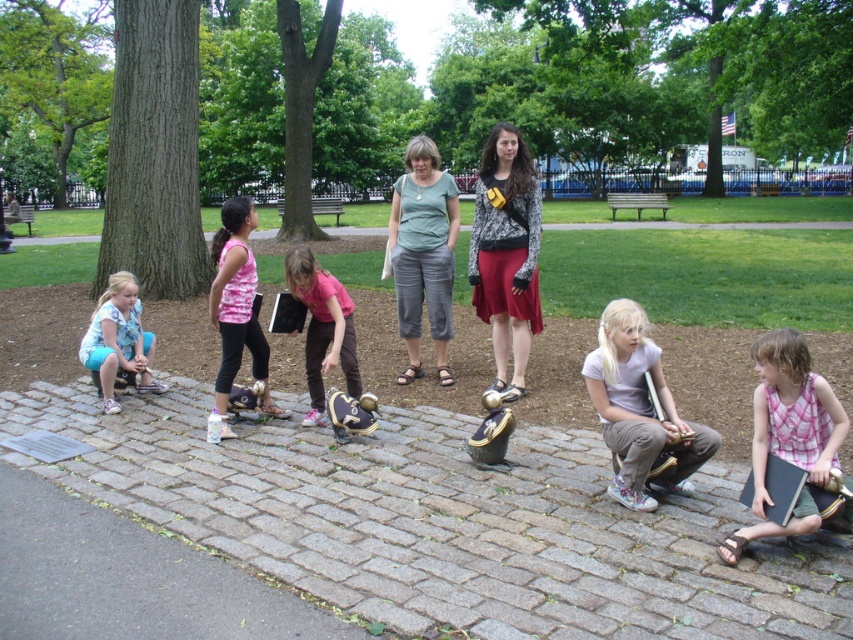
Question: Is pink plaid shirt at lower right above matte pink tank top at center?

Choices:
 (A) no
 (B) yes

Answer: (A)

Question: Is matte green blouse at center to the left of light blue denim shorts at lower left from the viewer's perspective?

Choices:
 (A) yes
 (B) no

Answer: (B)

Question: Which object appears closest to the camera in this image?

Choices:
 (A) matte black sweater at center
 (B) light blue denim shorts at lower left

Answer: (A)

Question: Which of the following is the farthest from the observer?

Choices:
 (A) pink fabric baseball glove at center
 (B) matte pink tank top at center

Answer: (B)

Question: Where is pink plaid shirt at lower right located in relation to matte pink tank top at center in the image?

Choices:
 (A) above
 (B) below

Answer: (B)

Question: Which object appears closest to the camera in this image?

Choices:
 (A) gray cobblestone at center
 (B) pink fabric baseball glove at center

Answer: (A)